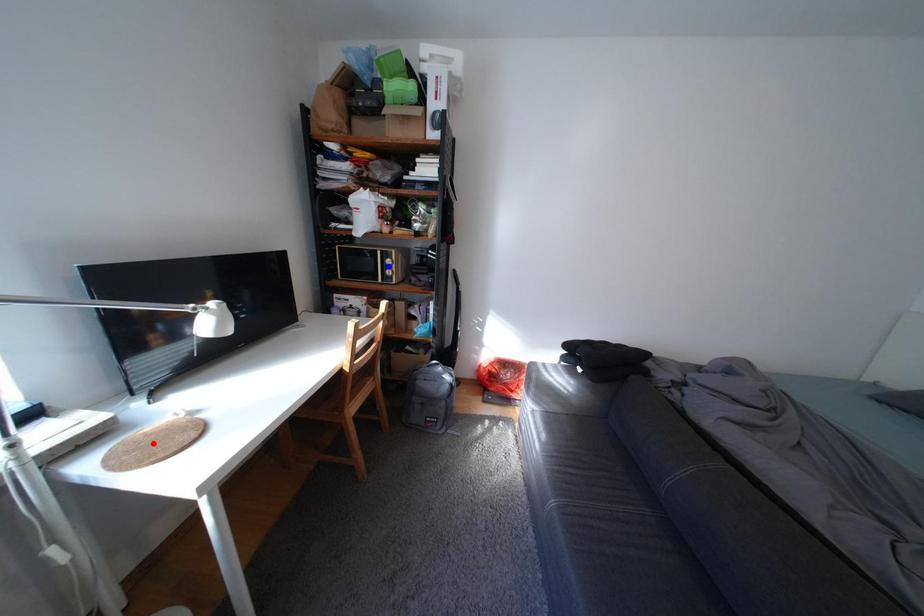
Question: In the image, two points are highlighted. Which point is nearer to the camera? Reply with the corresponding letter.

Choices:
 (A) blue point
 (B) red point

Answer: (B)